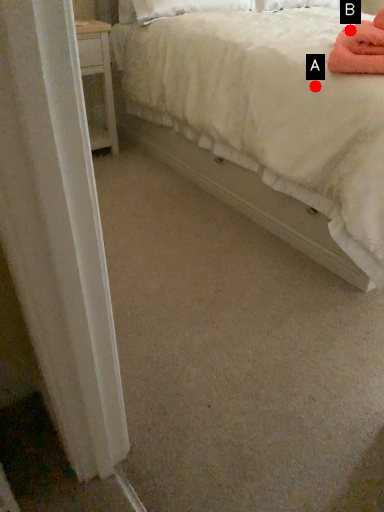
Question: Two points are circled on the image, labeled by A and B beside each circle. Among these points, which one is farthest from the camera?

Choices:
 (A) A is further
 (B) B is further

Answer: (B)